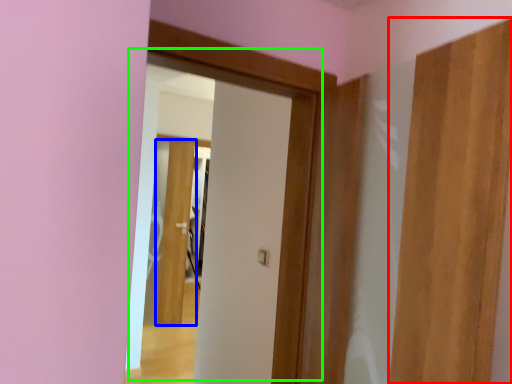
Question: Which object is the closest to the door (highlighted by a red box)? Choose among these: door (highlighted by a blue box) or door (highlighted by a green box).

Choices:
 (A) door
 (B) door

Answer: (B)